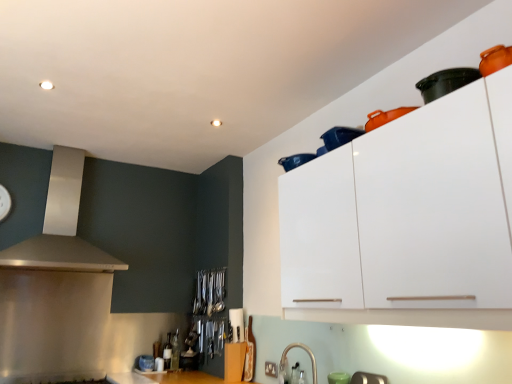
Locate an element on the screen. This screenshot has width=512, height=384. free spot below polished stainless steel cutlery at center (from a real-world perspective) is located at coordinates (204, 310).